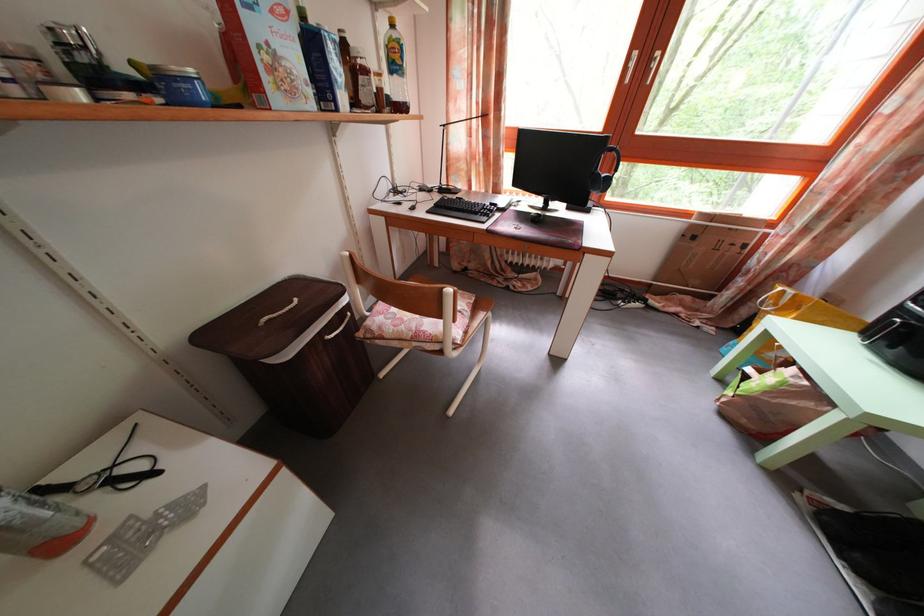
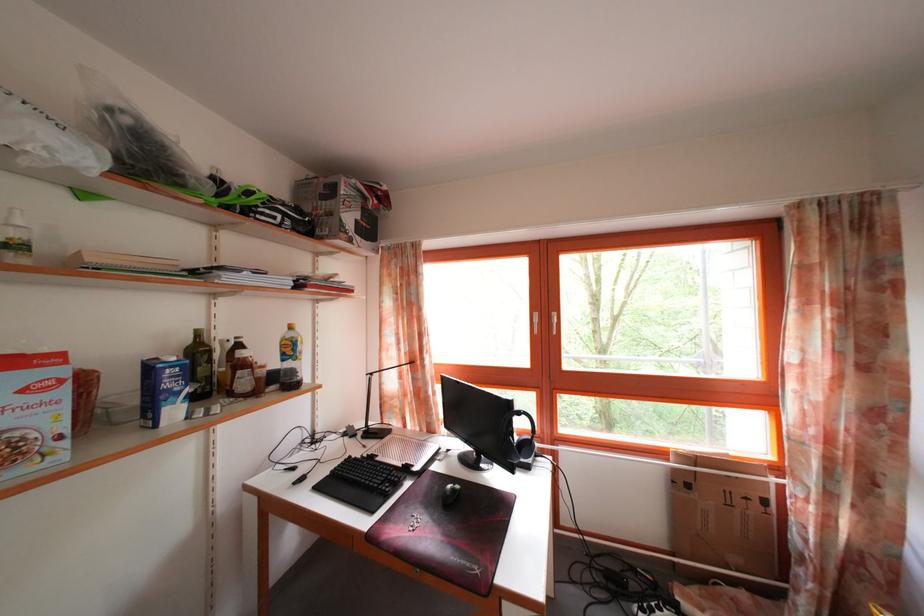
Question: How did the camera likely rotate?

Choices:
 (A) Left
 (B) Right
 (C) Up
 (D) Down

Answer: (C)